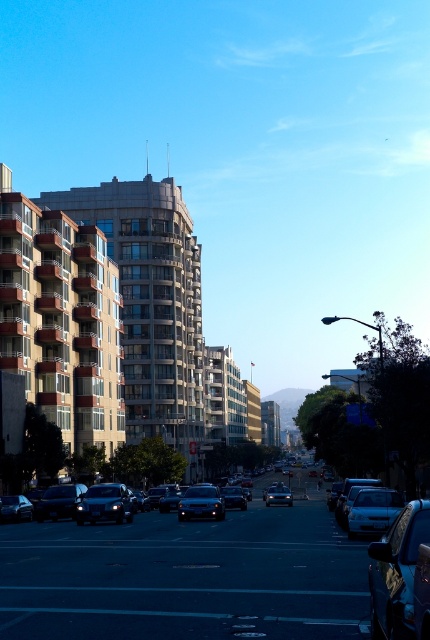
Is sleek silver sedan at center further to the viewer compared to shiny silver sedan at center?

No.

From the picture: Does sleek silver sedan at center have a larger size compared to shiny silver sedan at center?

Correct, sleek silver sedan at center is larger in size than shiny silver sedan at center.

You are a GUI agent. You are given a task and a screenshot of the screen. Output one action in this format:
    pyautogui.click(x=<x>, y=<y>)
    Task: Click on the sleek silver sedan at center
    The height and width of the screenshot is (640, 430).
    Given the screenshot: What is the action you would take?
    pyautogui.click(x=104, y=504)

Which is more to the left, shiny black car at lower right or sleek silver sedan at center?

Answer: sleek silver sedan at center is more to the left.

Is point (423, 513) positioned after point (116, 497)?

No, (423, 513) is in front of (116, 497).

What are the coordinates of `shiny black car at lower right` in the screenshot? It's located at (396, 572).

How much distance is there between shiny black car at lower right and shiny black sedan at center?

shiny black car at lower right and shiny black sedan at center are 127.58 feet apart from each other.

Is point (396, 560) more distant than point (24, 500)?

No, it is not.

Between point (418, 516) and point (27, 518), which one is positioned behind?

The point (27, 518) is behind.

This screenshot has width=430, height=640. I want to click on shiny black car at lower right, so click(396, 572).